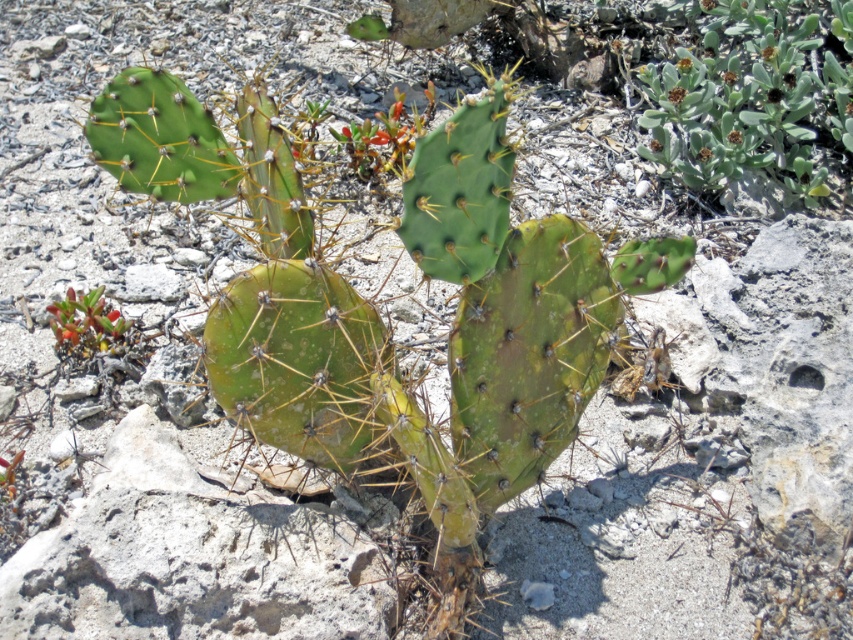
You are standing in front of the prickly pear cactus and want to reach two points marked in the image. The first point is at coordinate point (288, 438), and the second is at point (682, 128). Which point is closer to you?

Point (288, 438) is closer to the viewer than point (682, 128).